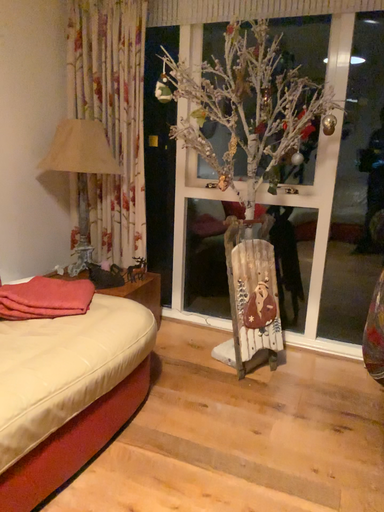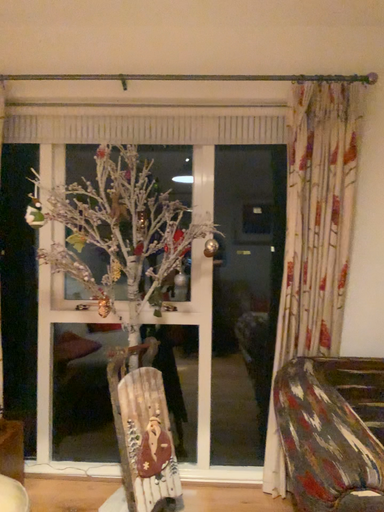
Question: How did the camera likely rotate when shooting the video?

Choices:
 (A) rotated upward
 (B) rotated downward

Answer: (A)